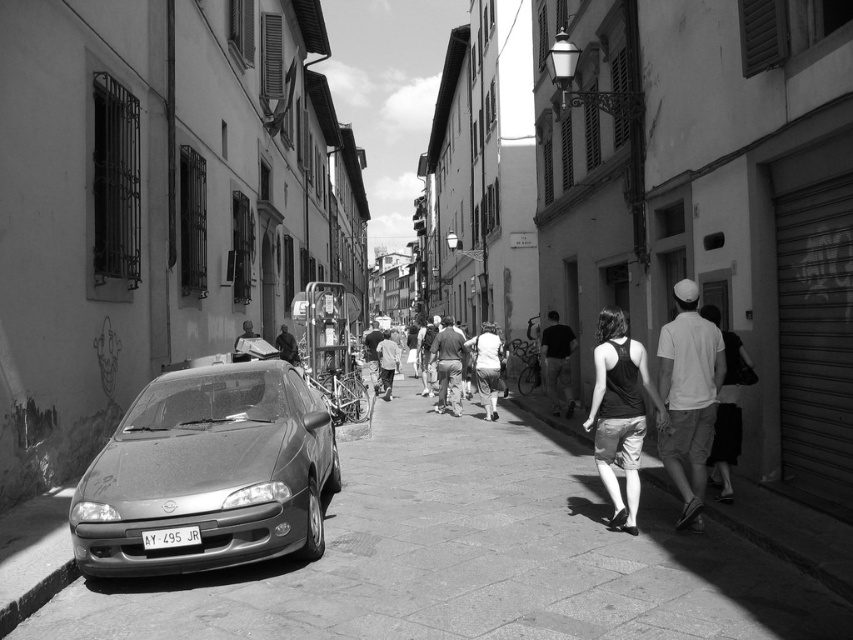
Question: Can you confirm if matte gray car at left is positioned below smooth skin person at center?

Choices:
 (A) no
 (B) yes

Answer: (B)

Question: Which of these objects is positioned farthest from the light gray cotton shirt at center?

Choices:
 (A) smooth skin person at center
 (B) smooth concrete pavement at lower left
 (C) white cotton shirt at right

Answer: (C)

Question: Estimate the real-world distances between objects in this image. Which object is farther from the dark gray fabric bag at center?

Choices:
 (A) black cotton tank top at center-right
 (B) dark fabric bag at center
 (C) matte gray car at left
 (D) white cotton backpack at center

Answer: (A)

Question: Does black cotton tank top at center-right come behind light gray cotton shirt at center?

Choices:
 (A) no
 (B) yes

Answer: (A)

Question: Observing the image, what is the correct spatial positioning of light gray cotton shorts at center-right in reference to dark fabric bag at center?

Choices:
 (A) right
 (B) left

Answer: (A)

Question: Which point is farther to the camera?

Choices:
 (A) white cotton backpack at center
 (B) black cotton tank top at center-right
 (C) dark gray fabric bag at center
 (D) light gray cotton shorts at center-right

Answer: (C)